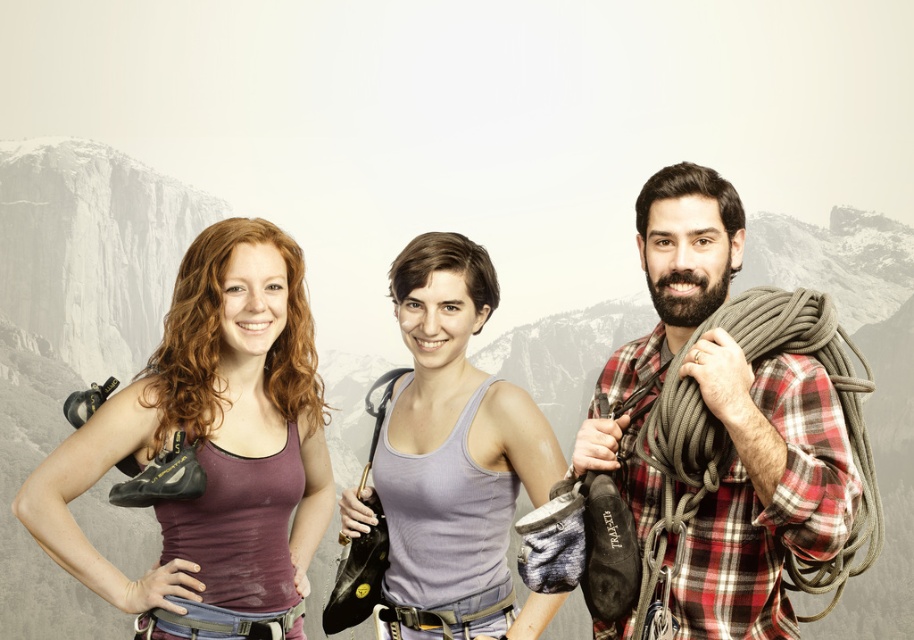
You are a photographer setting up a shot of the three people. You want to ensure that both the matte purple tank top at center and the plaid flannel shirt at center are clearly visible in the frame. Given their positions and sizes, which clothing item should you focus on to ensure both are in focus?

The matte purple tank top at center is taller than the plaid flannel shirt at center. Therefore, focusing on the matte purple tank top at center will ensure both items are in focus since it is the larger object in the frame.